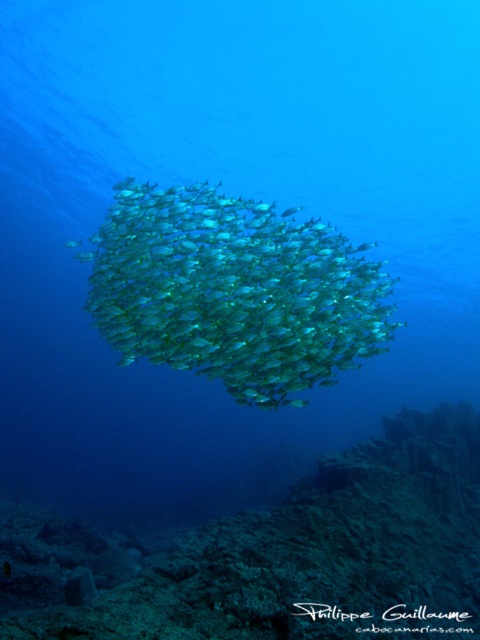
Who is positioned more to the left, rugged stone coral reef at center or translucent greenish-blue fish at center?

translucent greenish-blue fish at center is more to the left.

Is point (282, 624) farther from viewer compared to point (338, 296)?

No, it is in front of (338, 296).

Between point (419, 600) and point (131, 349), which one is positioned behind?

The point (131, 349) is behind.

At what (x,y) coordinates should I click in order to perform the action: click on rugged stone coral reef at center. Please return your answer as a coordinate pair (x, y). This screenshot has width=480, height=640. Looking at the image, I should click on (317, 554).